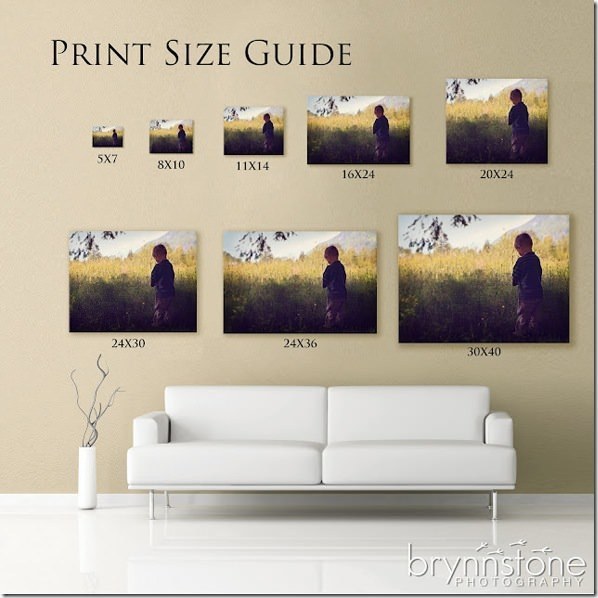
Locate an element on the screen. This screenshot has height=598, width=598. couch is located at coordinates (328, 417).